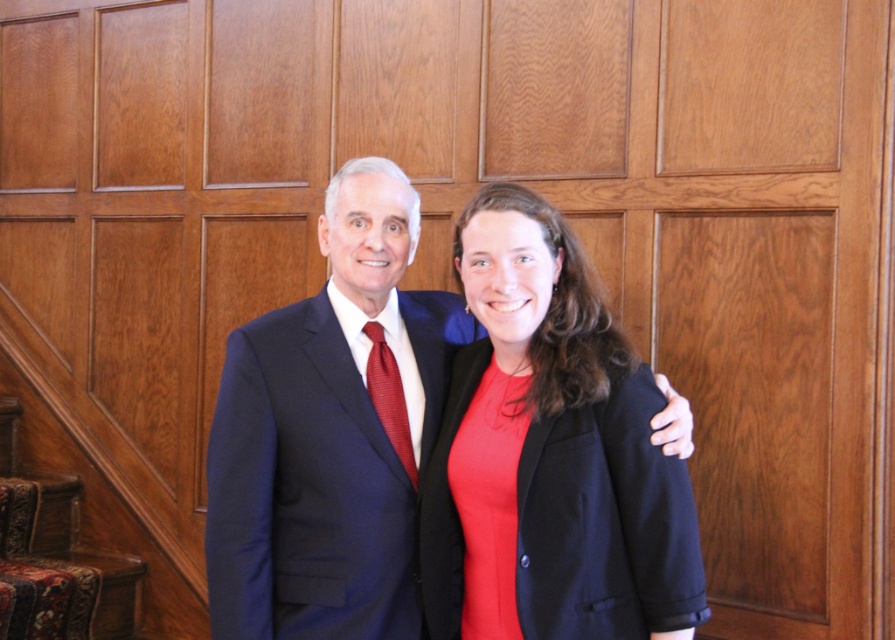
Question: Considering the real-world distances, which object is closest to the matte black blazer at center?

Choices:
 (A) red textured tie at center
 (B) matte black suit at center

Answer: (B)

Question: Can you confirm if matte black blazer at center is smaller than matte black suit at center?

Choices:
 (A) no
 (B) yes

Answer: (B)

Question: Does matte black blazer at center appear over red textured tie at center?

Choices:
 (A) no
 (B) yes

Answer: (A)

Question: Observing the image, what is the correct spatial positioning of matte black suit at center in reference to red textured tie at center?

Choices:
 (A) below
 (B) above

Answer: (A)

Question: Which point is farther to the camera?

Choices:
 (A) matte black blazer at center
 (B) matte black suit at center
 (C) red textured tie at center

Answer: (C)

Question: Considering the real-world distances, which object is closest to the matte black suit at center?

Choices:
 (A) matte black blazer at center
 (B) red textured tie at center

Answer: (B)